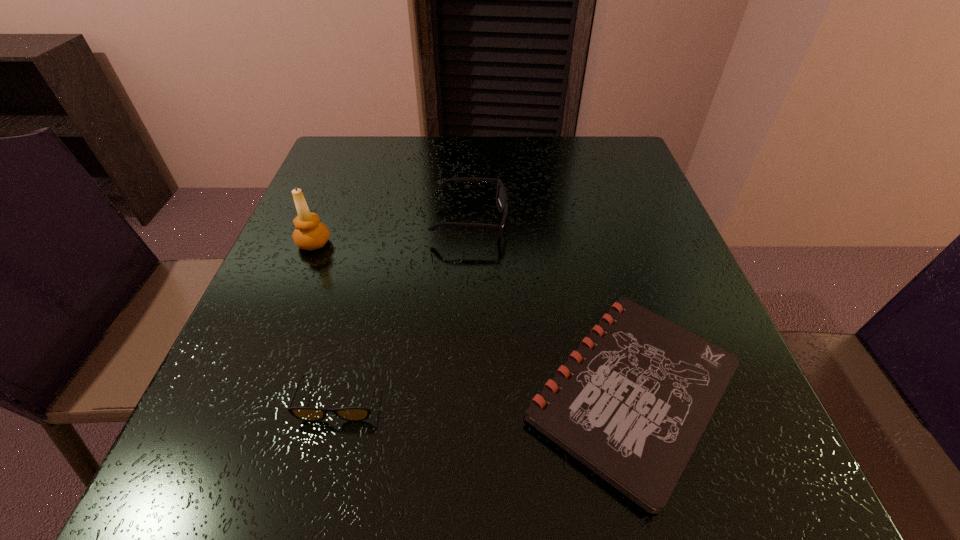
Find the location of a particular element. This screenshot has width=960, height=540. candle_holder is located at coordinates (310, 234).

The height and width of the screenshot is (540, 960). In order to click on the tallest object in this screenshot , I will do `click(310, 234)`.

At what (x,y) coordinates should I click in order to perform the action: click on the third shortest object. Please return your answer as a coordinate pair (x, y). Looking at the image, I should click on (501, 196).

This screenshot has height=540, width=960. I want to click on the third object from left to right, so click(501, 196).

At what (x,y) coordinates should I click in order to perform the action: click on the left sunglasses. Please return your answer as a coordinate pair (x, y). The image size is (960, 540). Looking at the image, I should click on (313, 414).

Locate an element on the screen. The height and width of the screenshot is (540, 960). the nearer sunglasses is located at coordinates tap(313, 414).

Find the location of a particular element. the shortest object is located at coordinates (640, 390).

Locate an element on the screen. The height and width of the screenshot is (540, 960). notebook is located at coordinates (640, 390).

The image size is (960, 540). I want to click on vacant space located on the back of the leftmost object, so click(353, 147).

Where is `vacant space situated 0.190m on the front-facing side of the second tallest object`? vacant space situated 0.190m on the front-facing side of the second tallest object is located at coordinates (596, 221).